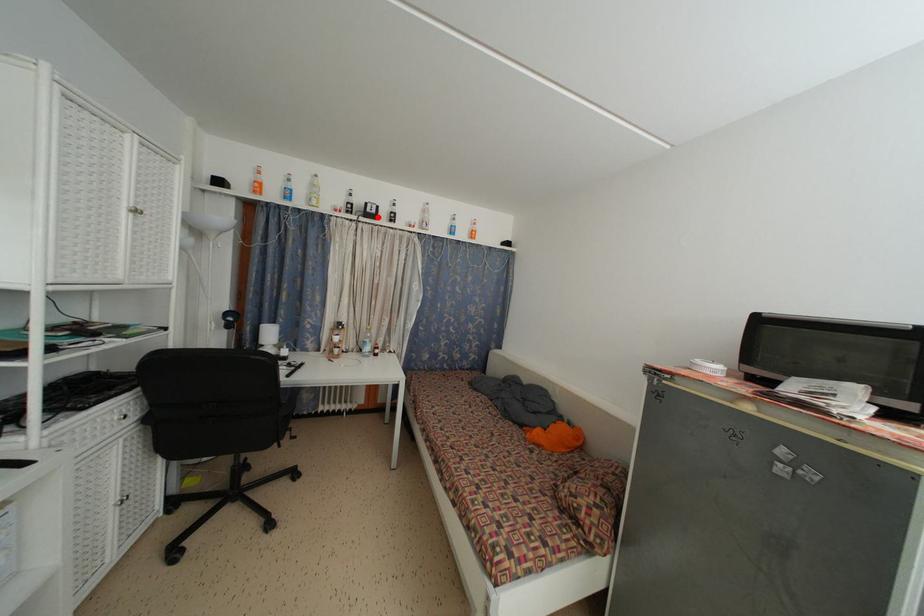
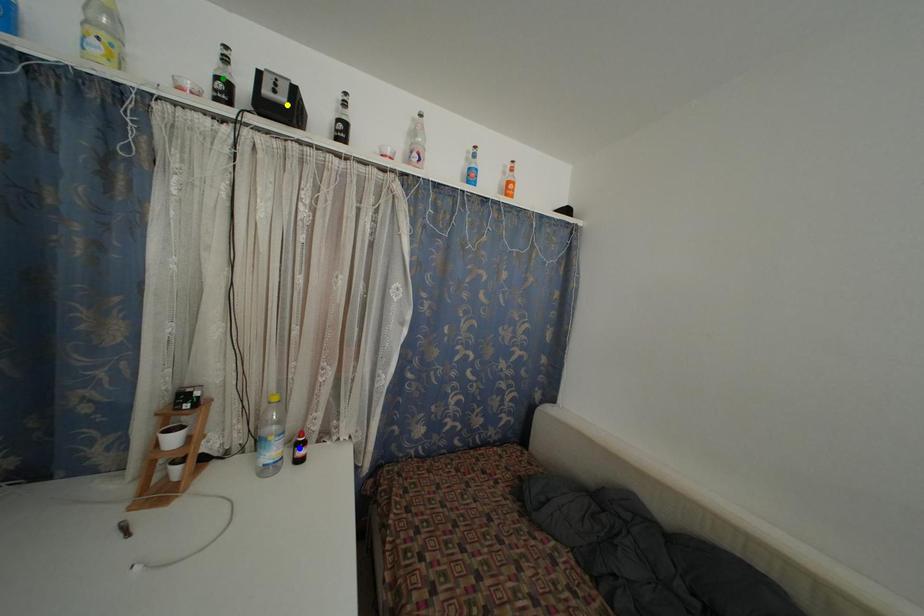
Question: I am providing you with two images of the same scene from different viewpoints. A red point is marked on the first image. You are given multiple points on the second image. Which point in image 2 is actually the same real-world point as the red point in image 1?

Choices:
 (A) yellow point
 (B) green point
 (C) blue point

Answer: (A)